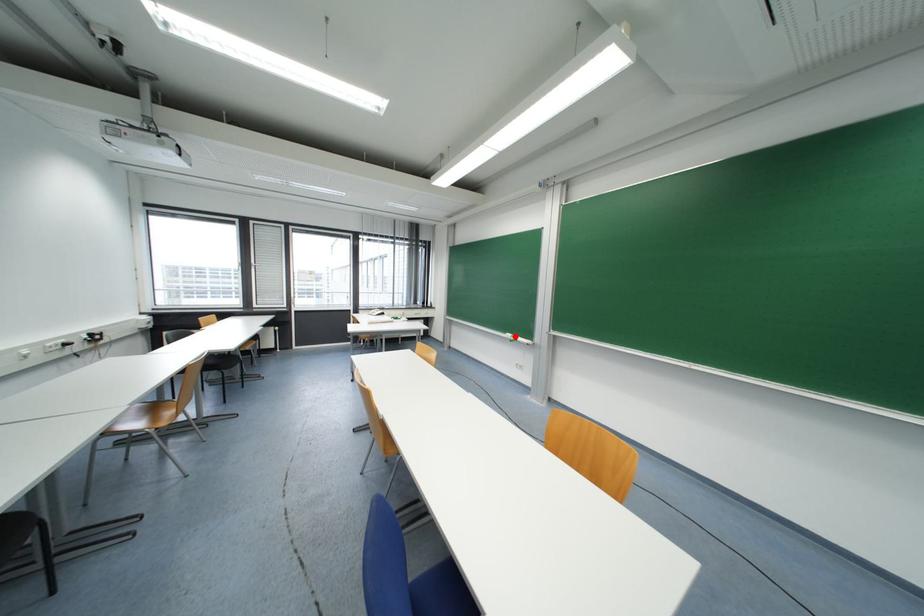
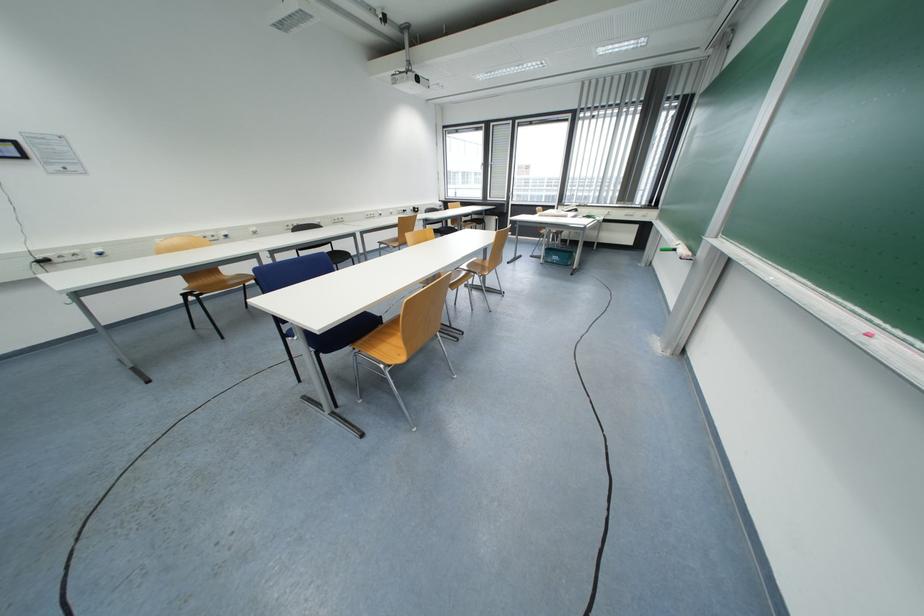
Where in the second image is the point corresponding to the highlighted location from the first image?

(683, 244)